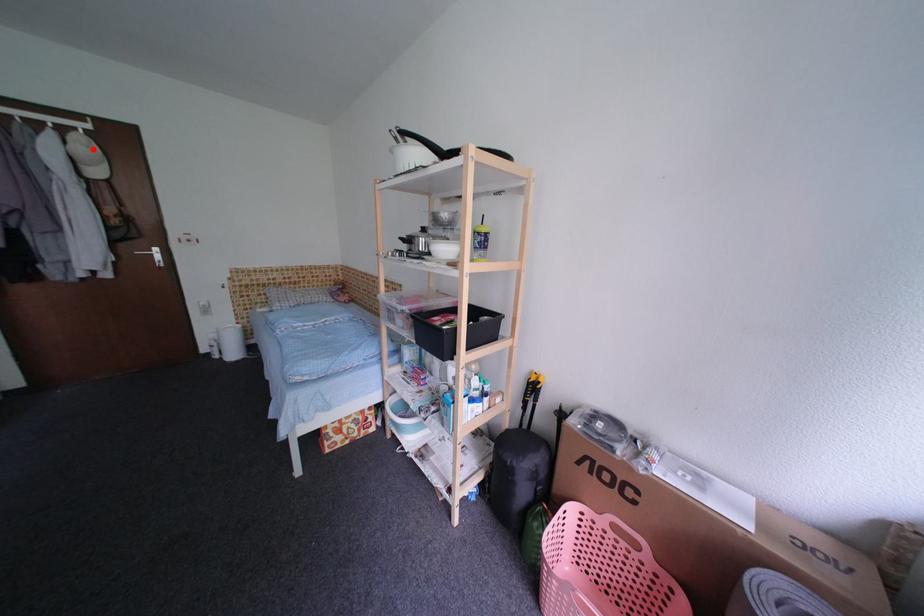
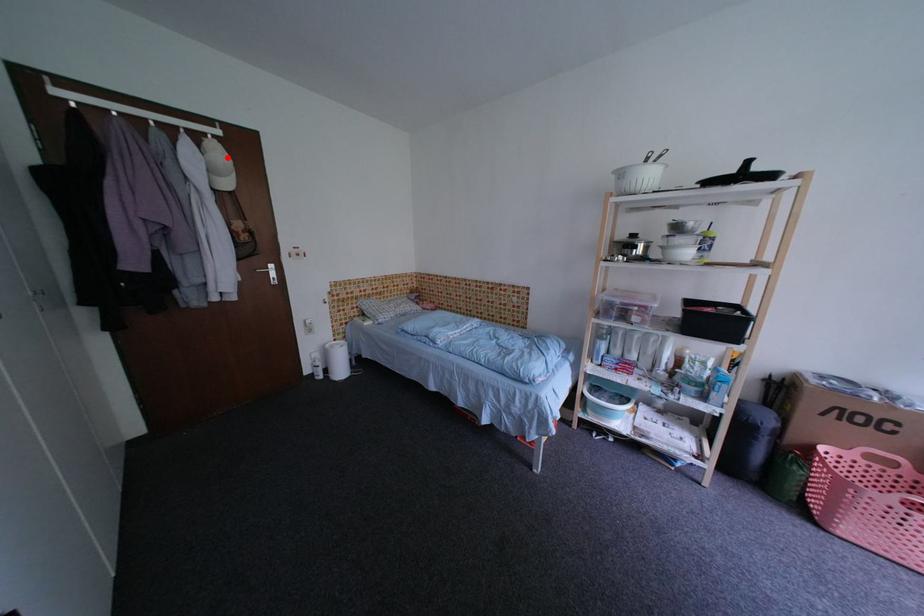
I am providing you with two images of the same scene from different viewpoints. A red point is marked on the first image and another point is marked on the second image. Does the point marked in image1 correspond to the same location as the one in image2?

Yes